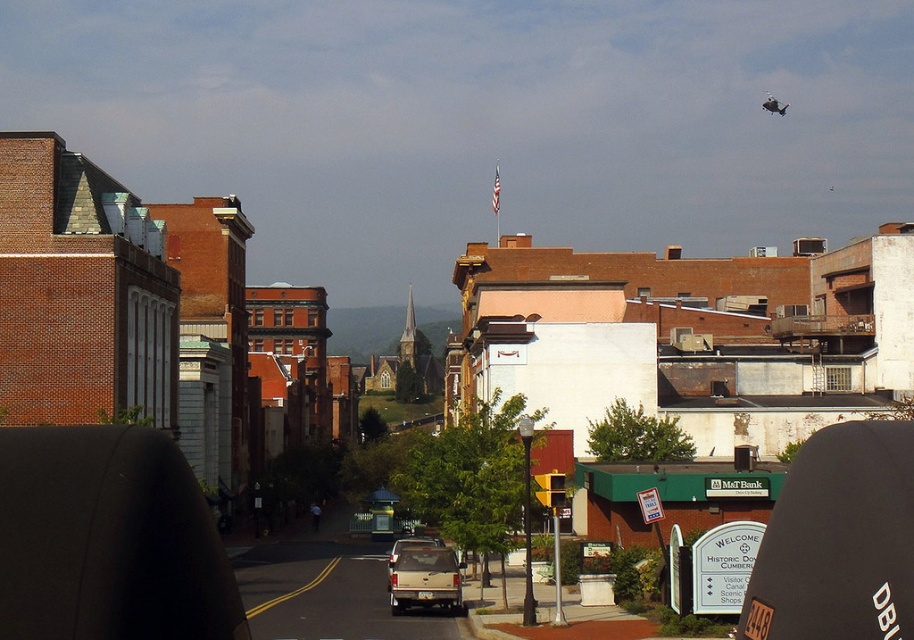
Question: Which of the following is the farthest from the observer?

Choices:
 (A) beige matte truck at center
 (B) matte white truck at center

Answer: (B)

Question: Is beige matte truck at center closer to the viewer compared to matte white truck at center?

Choices:
 (A) yes
 (B) no

Answer: (A)

Question: Among these objects, which one is farthest from the camera?

Choices:
 (A) matte white truck at center
 (B) beige matte truck at center

Answer: (A)

Question: Can you confirm if beige matte truck at center is smaller than matte white truck at center?

Choices:
 (A) yes
 (B) no

Answer: (A)

Question: In this image, where is beige matte truck at center located relative to matte white truck at center?

Choices:
 (A) below
 (B) above

Answer: (B)